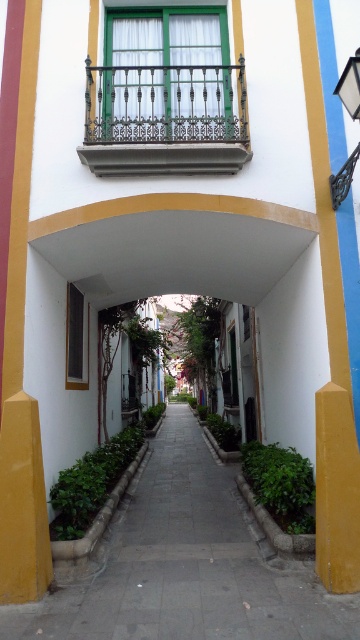
You are a delivery person carrying a heavy box and need to navigate through the alley. The paved stone walkway at center is where you are standing. Can you step onto the wrought iron balcony at upper center from your current position?

The paved stone walkway at center is closer to the viewer than the wrought iron balcony at upper center, so stepping from the paved stone walkway at center to the wrought iron balcony at upper center may not be possible due to the distance between them.

You are standing in the alleyway and want to move from the starting point to the destination point. The starting point is at point (111, 166) and the destination is at point (201, 522). Since the alley is narrow, you need to check if the path between these two points is clear. Based on the scene description, can you determine if there are any obstacles between them?

The point (201, 522) is behind point (111, 166), so the path between them is clear as there are no obstacles mentioned in the scene description. You can proceed safely.